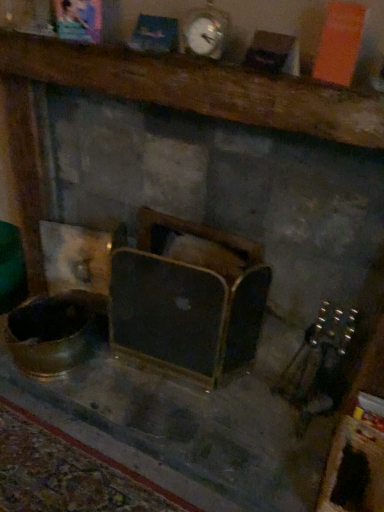
Identify the location of free spot to the right of metallic silver clock at upper center. (253, 66).